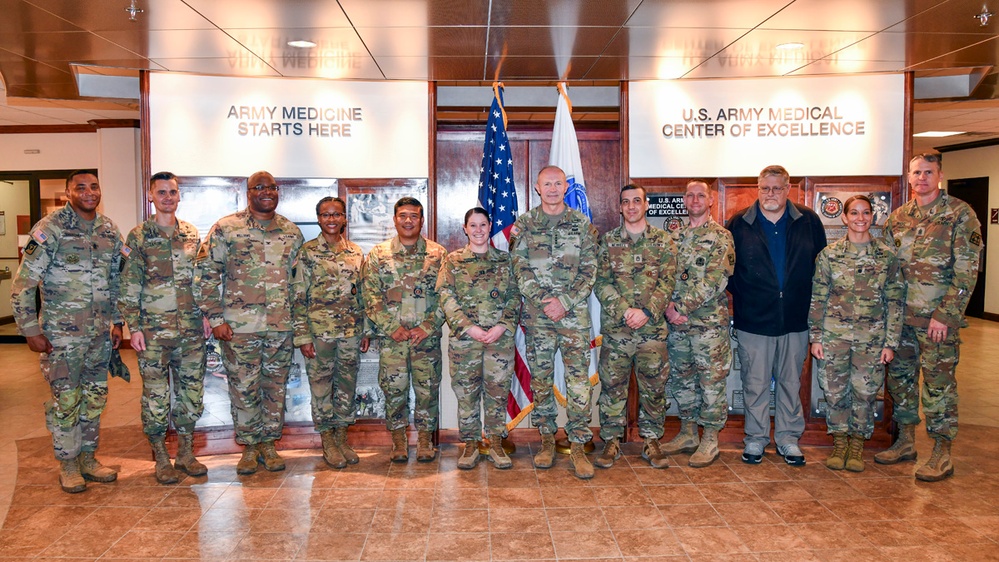
Find the location of a particular element. The image size is (999, 562). floor is located at coordinates (549, 516).